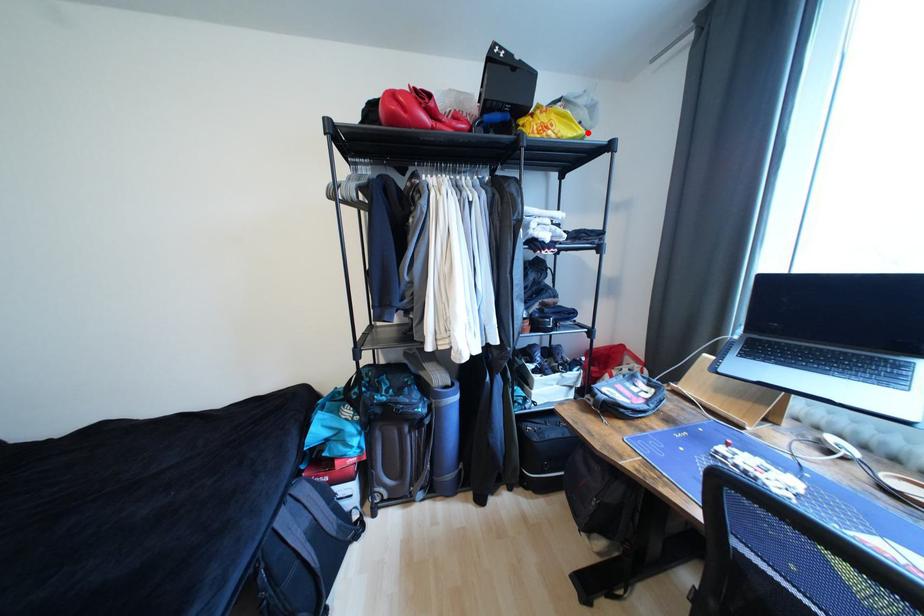
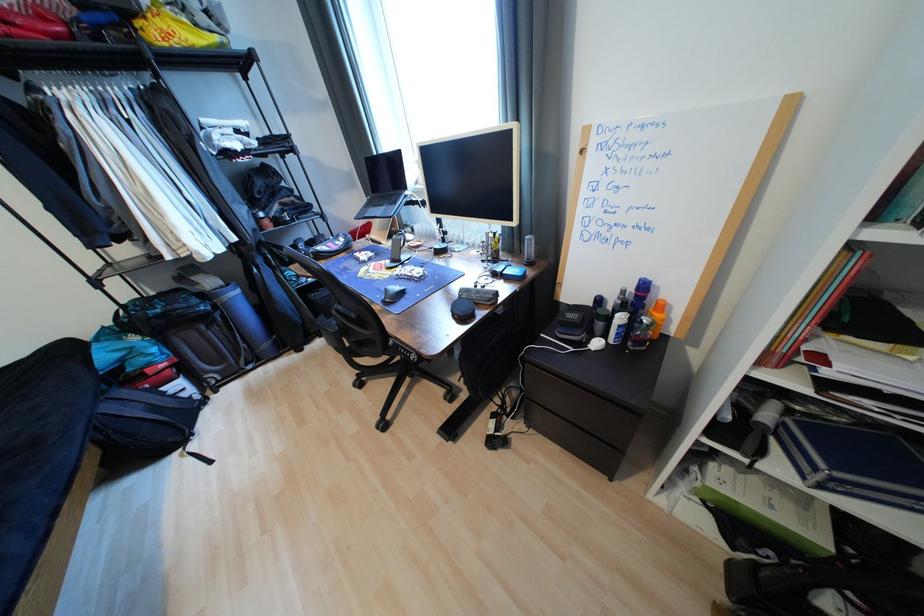
Question: I am providing you with two images of the same scene from different viewpoints. Given a red point in image1, look at the same physical point in image2. Is it:

Choices:
 (A) Closer to the viewpoint
 (B) Farther from the viewpoint

Answer: (B)